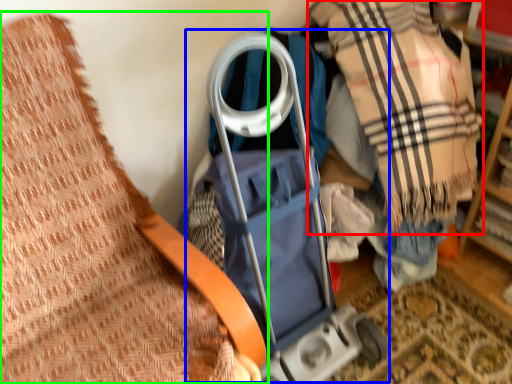
Question: Which object is positioned farthest from plaid (highlighted by a red box)? Select from baby carriage (highlighted by a blue box) and furniture (highlighted by a green box).

Choices:
 (A) baby carriage
 (B) furniture

Answer: (B)